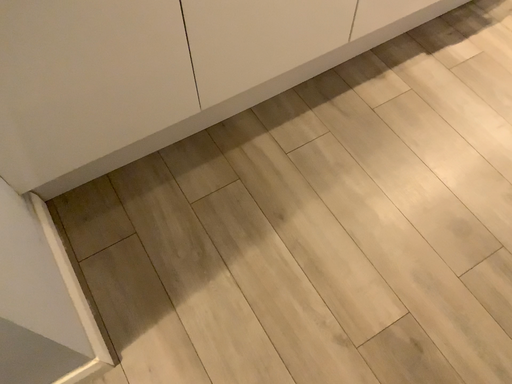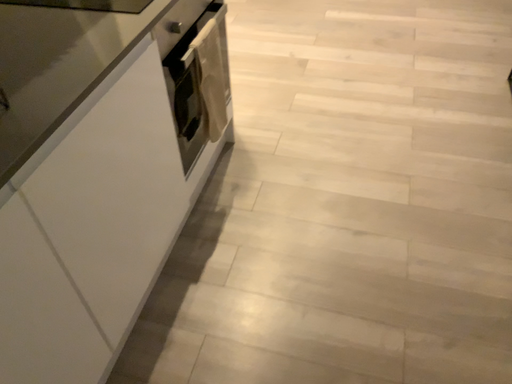
Question: How did the camera likely rotate when shooting the video?

Choices:
 (A) rotated left
 (B) rotated right

Answer: (B)